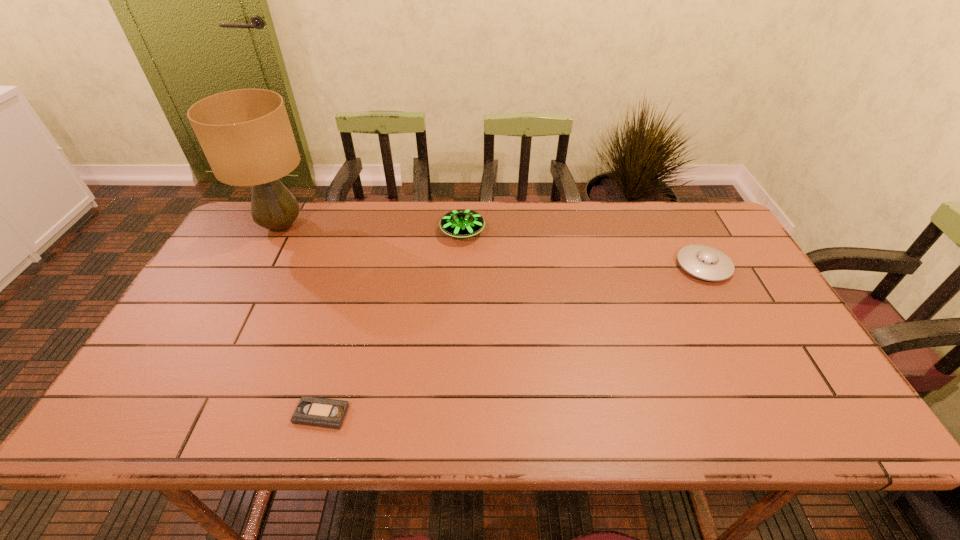
This screenshot has width=960, height=540. Identify the location of vacant space at the left edge of the desktop. (215, 284).

Locate an element on the screen. free space at the right edge of the desktop is located at coordinates (710, 285).

In the image, there is a desktop. In order to click on free space at the far right corner in this screenshot , I will do click(x=687, y=203).

This screenshot has width=960, height=540. In order to click on vacant space in between the nearer saucer and the shortest object in this screenshot , I will do `click(513, 340)`.

You are a GUI agent. You are given a task and a screenshot of the screen. Output one action in this format:
    pyautogui.click(x=<x>, y=<y>)
    Task: Click on the empty space between the videotape and the farther saucer
    The width and height of the screenshot is (960, 540).
    Given the screenshot: What is the action you would take?
    pyautogui.click(x=392, y=323)

The image size is (960, 540). In order to click on free space between the farther saucer and the tallest object in this screenshot , I will do `click(372, 229)`.

This screenshot has height=540, width=960. What are the coordinates of `free point between the rightmost object and the nearest object` in the screenshot? It's located at (513, 340).

You are a GUI agent. You are given a task and a screenshot of the screen. Output one action in this format:
    pyautogui.click(x=<x>, y=<y>)
    Task: Click on the unoccupied area between the lampshade and the third tallest object
    This screenshot has width=960, height=540.
    Given the screenshot: What is the action you would take?
    pyautogui.click(x=492, y=246)

You are a GUI agent. You are given a task and a screenshot of the screen. Output one action in this format:
    pyautogui.click(x=<x>, y=<y>)
    Task: Click on the empty space that is in between the leftmost object and the rightmost object
    
    Given the screenshot: What is the action you would take?
    pyautogui.click(x=492, y=246)

Where is `vacant region between the shortest object and the shorter saucer`? This screenshot has height=540, width=960. vacant region between the shortest object and the shorter saucer is located at coordinates (513, 340).